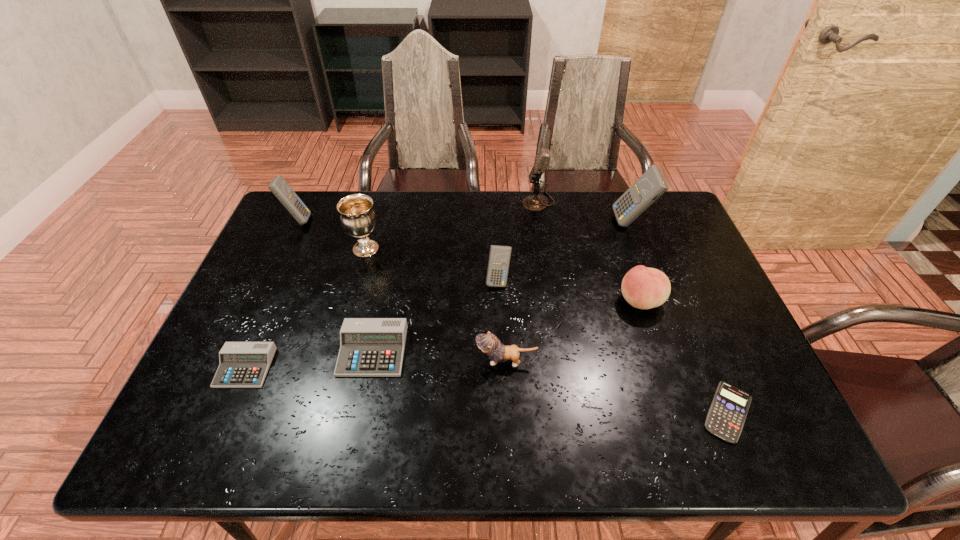
This screenshot has width=960, height=540. Identify the location of the fourth tallest calculator. (369, 347).

In order to click on the right gray calculator in this screenshot , I will do `click(369, 347)`.

Identify the location of the second shortest object. (241, 364).

I want to click on the second shortest calculator, so click(x=241, y=364).

Where is `the shortest calculator`? This screenshot has height=540, width=960. the shortest calculator is located at coordinates (727, 414).

Where is `the smallest blue calculator`? The image size is (960, 540). the smallest blue calculator is located at coordinates (727, 414).

At what (x,y) coordinates should I click in order to perform the action: click on free location located on the front-facing side of the microphone. Please return your answer as a coordinate pair (x, y). Looking at the image, I should click on (459, 201).

I want to click on free space located 0.340m on the front-facing side of the microphone, so click(423, 201).

In order to click on vacant space located on the front-facing side of the microphone in this screenshot , I will do `click(406, 201)`.

This screenshot has height=540, width=960. What are the coordinates of `free space located on the front-facing side of the biggest blue calculator` in the screenshot? It's located at (586, 222).